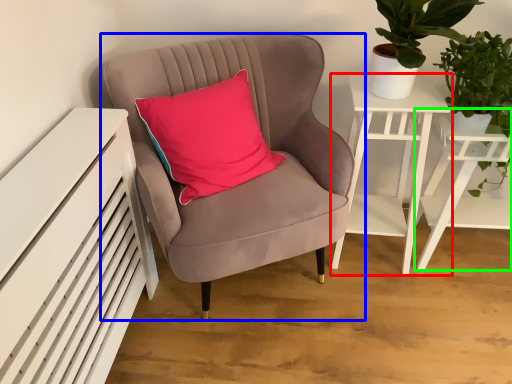
Question: Estimate the real-world distances between objects in this image. Which object is closer to nightstand (highlighted by a red box), chair (highlighted by a blue box) or table (highlighted by a green box)?

Choices:
 (A) chair
 (B) table

Answer: (B)